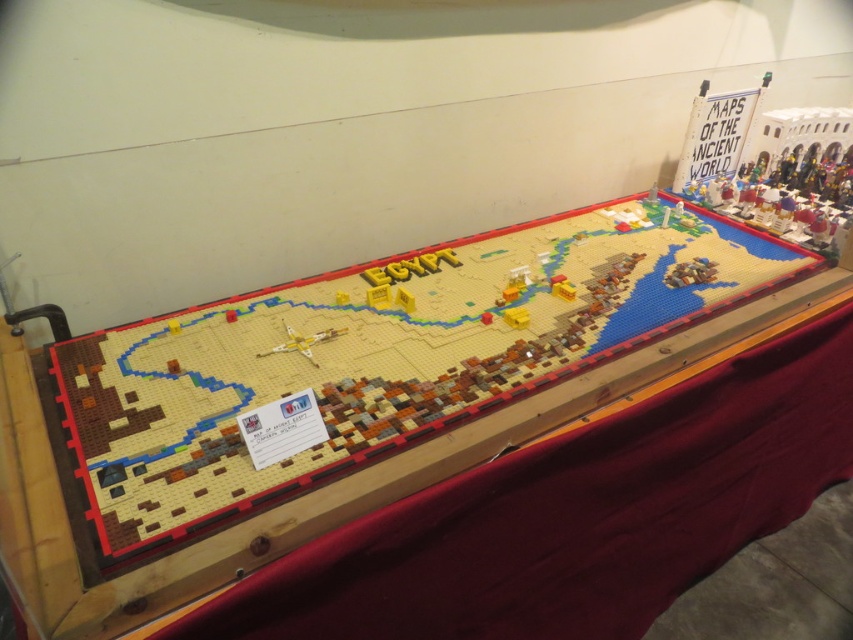
Based on the photo, does wooden table at center appear on the left side of translucent yellow airplane at center?

No, wooden table at center is not to the left of translucent yellow airplane at center.

Between wooden table at center and translucent yellow airplane at center, which one has more height?

Standing taller between the two is wooden table at center.

Is point (223, 422) less distant than point (265, 355)?

Yes.

Locate an element on the screen. wooden table at center is located at coordinates (347, 428).